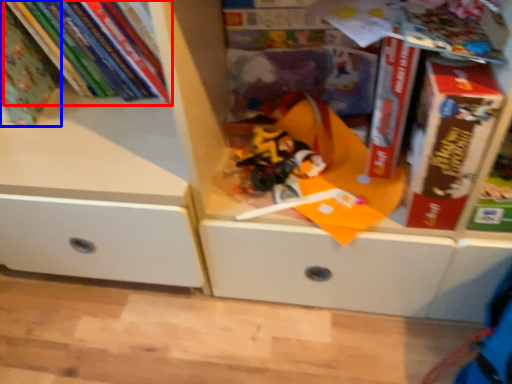
Question: Which object appears farthest to the camera in this image, book (highlighted by a red box) or book (highlighted by a blue box)?

Choices:
 (A) book
 (B) book

Answer: (A)